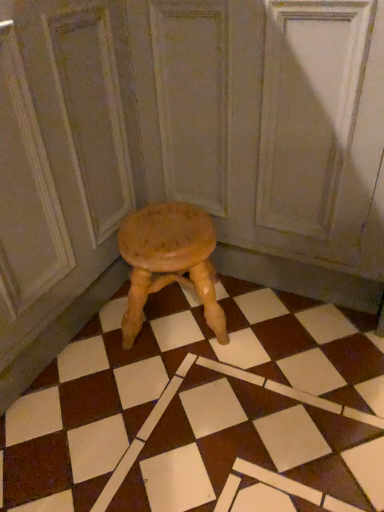
I want to click on wooden stool at center, so click(200, 407).

This screenshot has width=384, height=512. What do you see at coordinates (200, 407) in the screenshot?
I see `wooden stool at center` at bounding box center [200, 407].

Locate an element on the screen. The width and height of the screenshot is (384, 512). wooden stool at center is located at coordinates (200, 407).